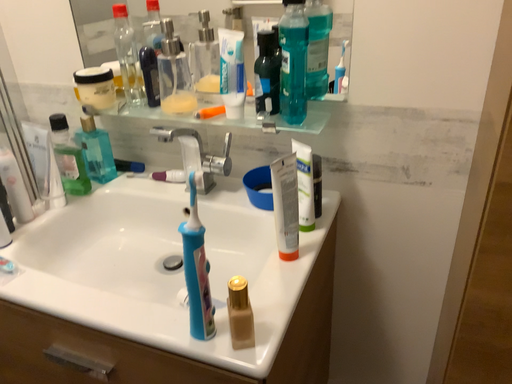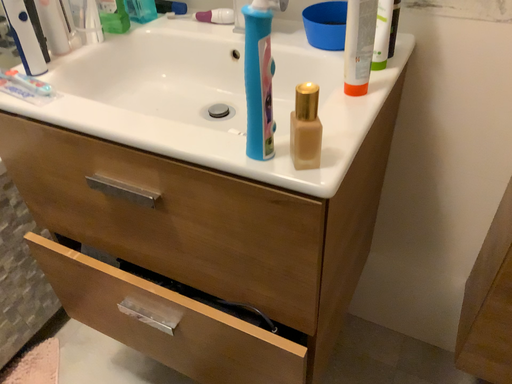
Question: Which way did the camera rotate in the video?

Choices:
 (A) rotated upward
 (B) rotated downward

Answer: (B)